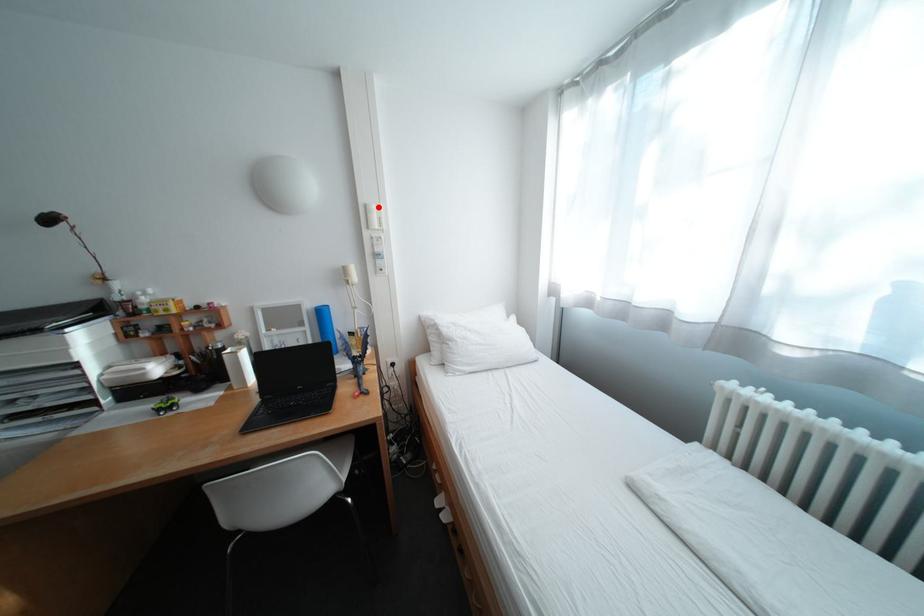
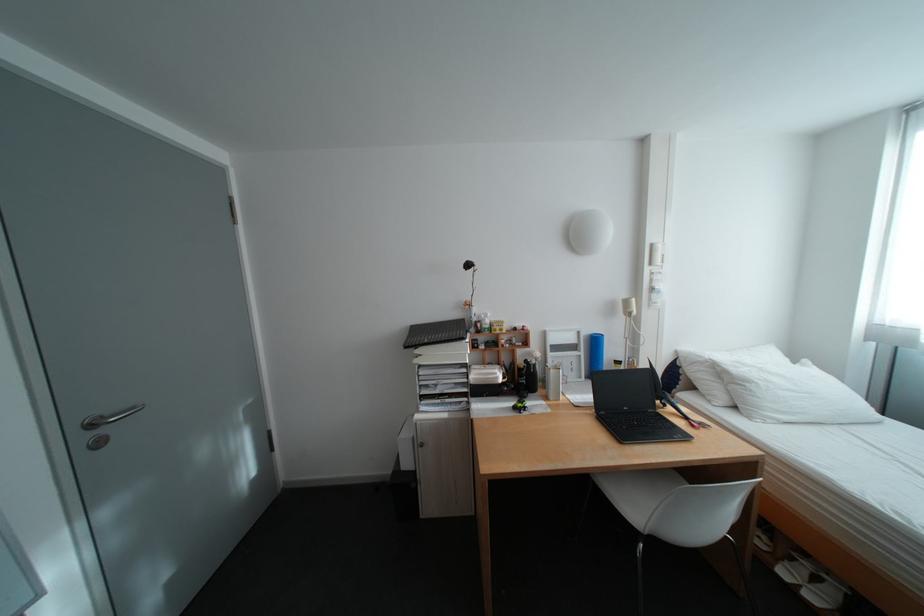
The point at the highlighted location is marked in the first image. Where is the corresponding point in the second image?

(664, 246)